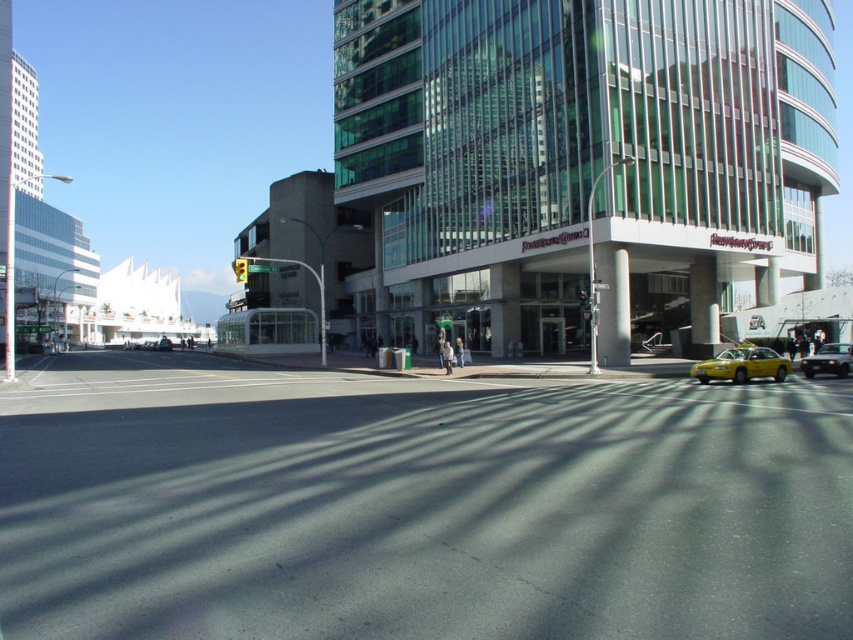
You are a pedestrian standing at the crosswalk near the green glass traffic light at upper center. You want to cross the street to the other side. Is the metallic silver sedan at right blocking your path?

The metallic silver sedan at right is to the right of the green glass traffic light at upper center, so it is not directly blocking your path from the crosswalk. However, you should still check for moving vehicles before crossing.

You are a pedestrian standing at the point with coordinates point (x=204, y=588) and want to walk to the point with coordinates point (x=817, y=362). Based on the scene description, will you have to walk towards the building or away from it?

Since point (x=204, y=588) is in front of point (x=817, y=362), you will have to walk away from the building to reach your destination.